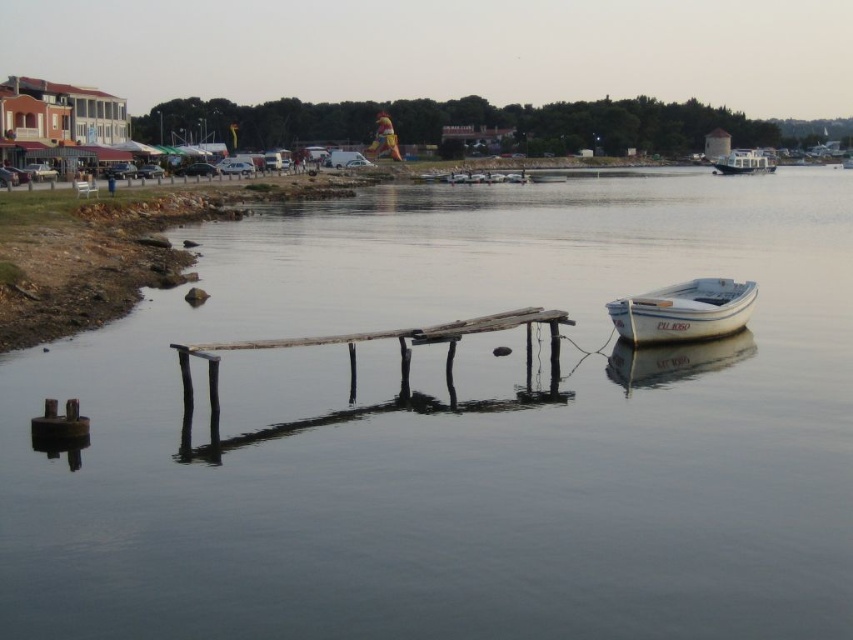
Measure the distance between transparent water at center and white glossy houseboat at upper right.

A distance of 75.35 meters exists between transparent water at center and white glossy houseboat at upper right.

Identify the location of transparent water at center. (456, 429).

What do you see at coordinates (456, 429) in the screenshot? I see `transparent water at center` at bounding box center [456, 429].

Locate an element on the screen. The image size is (853, 640). transparent water at center is located at coordinates (456, 429).

Measure the distance between transparent water at center and weathered wood dock at center.

They are 21.90 meters apart.

Does transparent water at center have a smaller size compared to weathered wood dock at center?

Incorrect, transparent water at center is not smaller in size than weathered wood dock at center.

Which is behind, point (265, 404) or point (454, 342)?

The point (454, 342) is more distant.

This screenshot has height=640, width=853. Identify the location of transparent water at center. (456, 429).

Who is positioned more to the right, white matte boat at lower right or white glossy houseboat at upper right?

Positioned to the right is white glossy houseboat at upper right.

In order to click on white matte boat at lower right in this screenshot , I will do `click(683, 310)`.